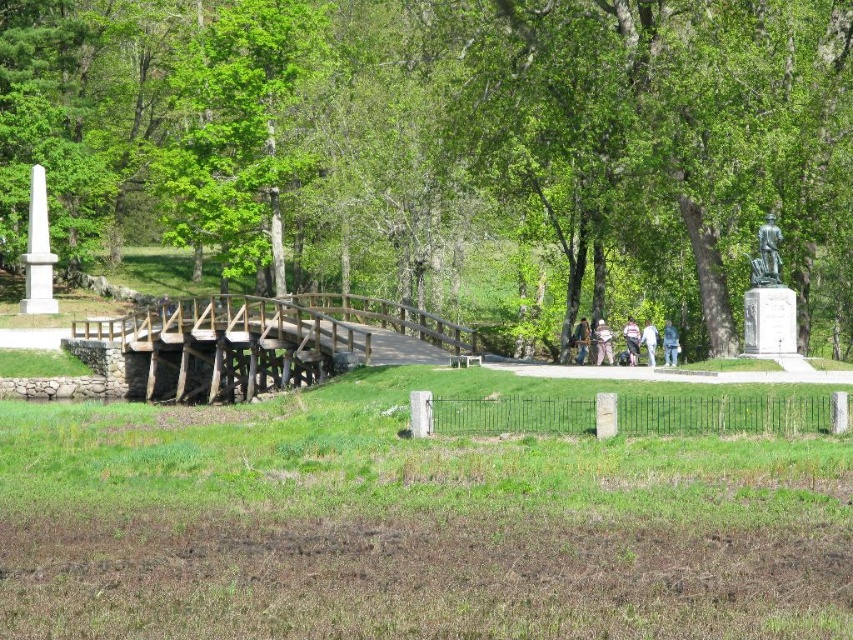
Question: Among these points, which one is farthest from the camera?

Choices:
 (A) (212, 314)
 (B) (579, 352)
 (C) (595, 364)

Answer: (A)

Question: Where is green leafy tree at center located in relation to light blue jeans at center in the image?

Choices:
 (A) below
 (B) above

Answer: (B)

Question: Does wooden bridge at center have a greater width compared to bronze statue at right?

Choices:
 (A) no
 (B) yes

Answer: (B)

Question: Which point is closer to the camera?

Choices:
 (A) (36, 237)
 (B) (790, 333)
 (C) (672, 326)

Answer: (B)

Question: Which of these objects is positioned closest to the light brown fabric jacket at center?

Choices:
 (A) blue denim jeans at center
 (B) bronze statue at right
 (C) green leafy tree at center
 (D) light blue jeans at center

Answer: (D)

Question: Is the position of bronze statue at right less distant than that of white marble obelisk at left?

Choices:
 (A) yes
 (B) no

Answer: (A)